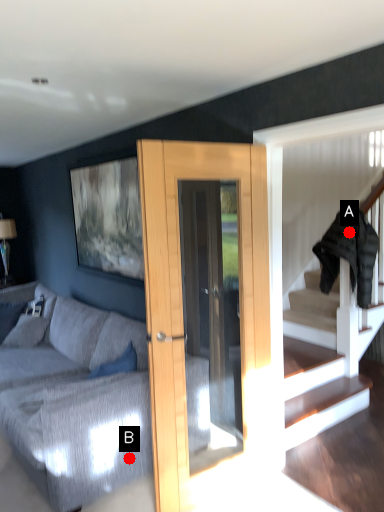
Question: Two points are circled on the image, labeled by A and B beside each circle. Which point is closer to the camera?

Choices:
 (A) A is closer
 (B) B is closer

Answer: (B)